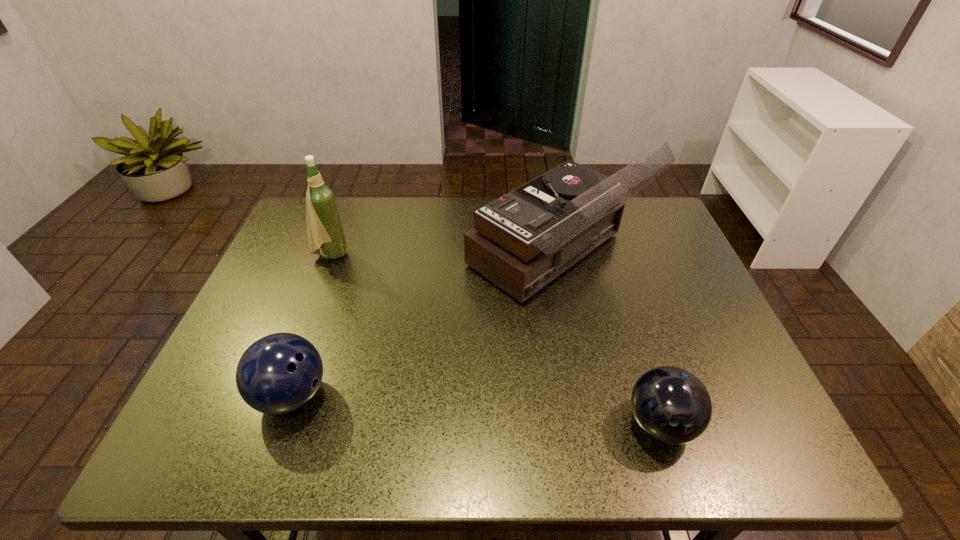
Identify the location of record player. This screenshot has height=540, width=960. (522, 241).

Where is `wine bottle`? The height and width of the screenshot is (540, 960). wine bottle is located at coordinates (324, 227).

Where is `the left bowling ball`? This screenshot has width=960, height=540. the left bowling ball is located at coordinates pos(279,373).

This screenshot has height=540, width=960. Find the location of `the right bowling ball`. the right bowling ball is located at coordinates (670, 404).

You are a GUI agent. You are given a task and a screenshot of the screen. Output one action in this format:
    pyautogui.click(x=<x>, y=<y>)
    Task: Click on the vacant point located 0.070m on the front of the record player
    The width and height of the screenshot is (960, 540).
    Given the screenshot: What is the action you would take?
    pyautogui.click(x=571, y=345)

Locate an element on the screen. vacant area situated 0.310m on the front-facing side of the wine bottle is located at coordinates (456, 254).

Find the location of a particular element. free space located 0.050m on the surface of the left bowling ball near the finger holes is located at coordinates (353, 395).

Where is `object positioned at the far edge`? This screenshot has width=960, height=540. object positioned at the far edge is located at coordinates (522, 241).

Locate an element on the screen. wine bottle that is at the left edge is located at coordinates (324, 227).

The image size is (960, 540). I want to click on bowling ball that is at the left edge, so click(279, 373).